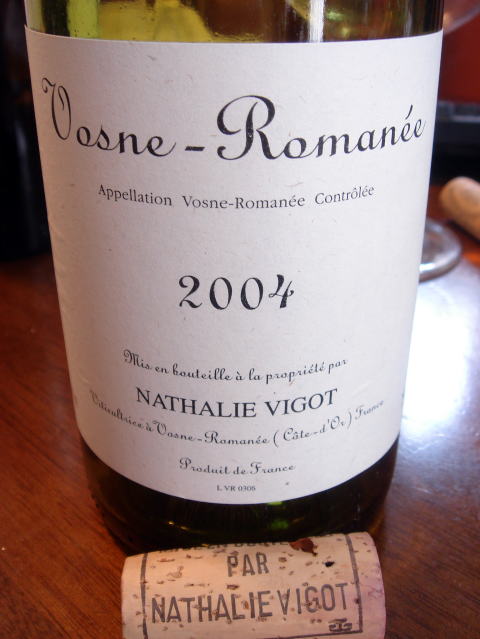
Where is `semi-opaque greenish brown wine bottle`? Image resolution: width=480 pixels, height=639 pixels. semi-opaque greenish brown wine bottle is located at coordinates (222, 24).